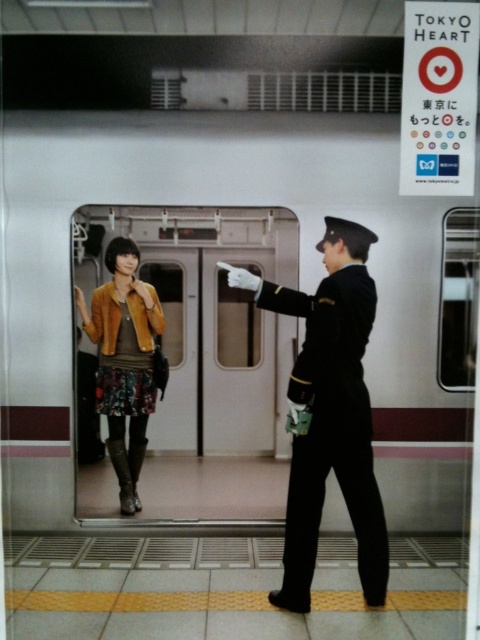
Does metallic silver train at center have a lesser width compared to velvet brown jacket at center?

No, metallic silver train at center is not thinner than velvet brown jacket at center.

Does metallic silver train at center appear on the left side of velvet brown jacket at center?

In fact, metallic silver train at center is to the right of velvet brown jacket at center.

Locate an element on the screen. The height and width of the screenshot is (640, 480). metallic silver train at center is located at coordinates pos(274,278).

Who is lower down, metallic silver train at center or black wool uniform at right?

black wool uniform at right is below.

Can you confirm if metallic silver train at center is bigger than black wool uniform at right?

Indeed, metallic silver train at center has a larger size compared to black wool uniform at right.

Find the location of a particular element. This screenshot has width=480, height=640. metallic silver train at center is located at coordinates (274, 278).

At what (x,y) coordinates should I click in order to perform the action: click on black wool uniform at right. Please return your answer as a coordinate pair (x, y). This screenshot has height=640, width=480. Looking at the image, I should click on (331, 429).

Does black wool uniform at right have a smaller size compared to velvet brown jacket at center?

Indeed, black wool uniform at right has a smaller size compared to velvet brown jacket at center.

The height and width of the screenshot is (640, 480). Find the location of `black wool uniform at right`. black wool uniform at right is located at coordinates (331, 429).